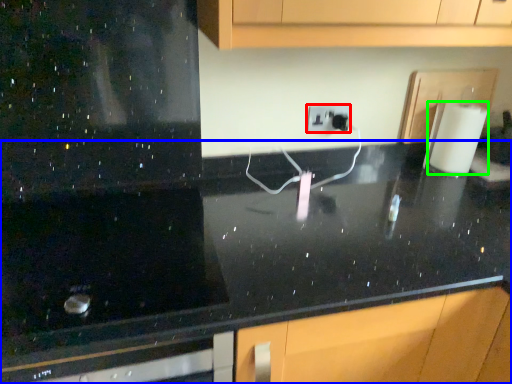
Question: Which is farther away from electric outlet (highlighted by a red box)? countertop (highlighted by a blue box) or paper towel (highlighted by a green box)?

Choices:
 (A) countertop
 (B) paper towel

Answer: (A)